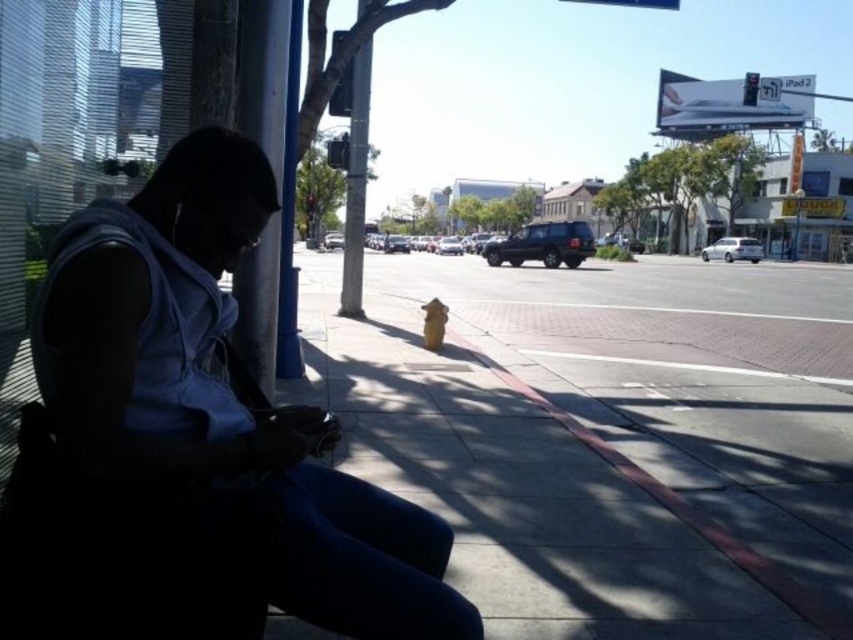
Question: Is yellow fire hydrant at center behind metallic pole at center?

Choices:
 (A) yes
 (B) no

Answer: (B)

Question: Estimate the real-world distances between objects in this image. Which object is farther from the metallic pole at center?

Choices:
 (A) matte gray hoodie at left
 (B) blue painted metal pole at left

Answer: (A)

Question: Is yellow fire hydrant at center closer to camera compared to blue painted metal pole at left?

Choices:
 (A) yes
 (B) no

Answer: (A)

Question: Which object is the farthest from the yellow fire hydrant at center?

Choices:
 (A) blue painted metal pole at left
 (B) metallic pole at center
 (C) matte gray hoodie at left

Answer: (B)

Question: Which of these objects is positioned closest to the metallic pole at center?

Choices:
 (A) matte gray hoodie at left
 (B) yellow fire hydrant at center

Answer: (B)

Question: Does matte gray hoodie at left come behind blue painted metal pole at left?

Choices:
 (A) no
 (B) yes

Answer: (A)